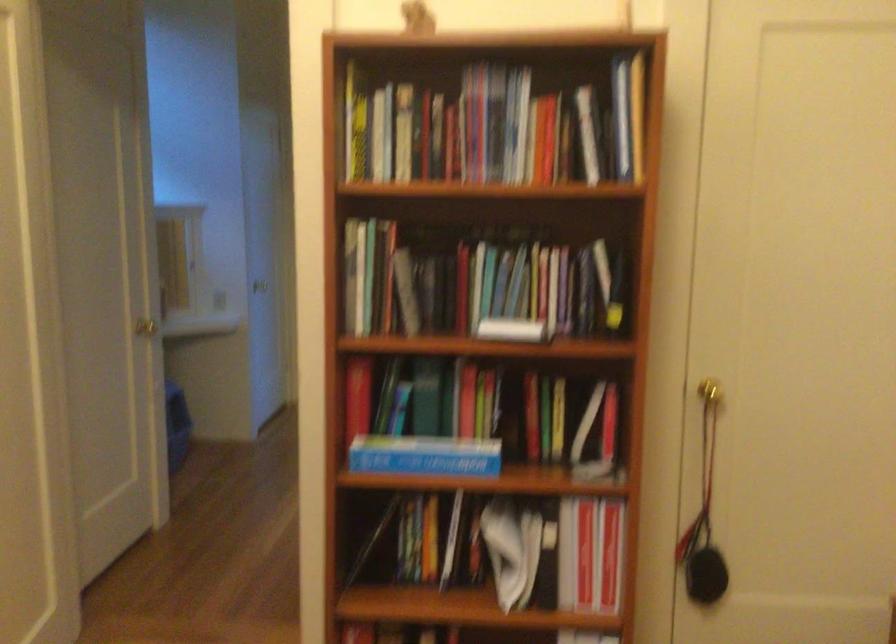
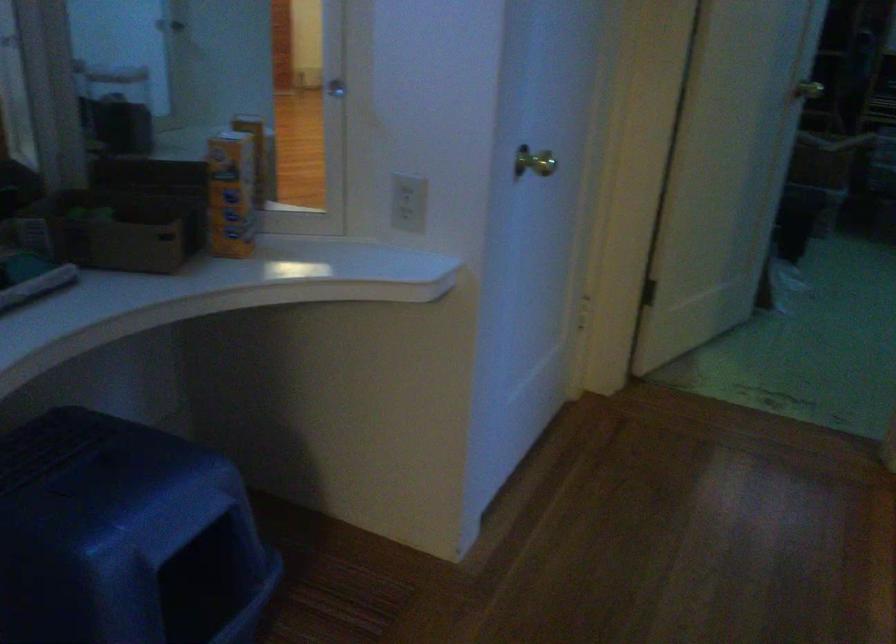
Question: What movement of the cameraman would produce the second image?

Choices:
 (A) Left
 (B) Right
 (C) Forward
 (D) Backward

Answer: (C)